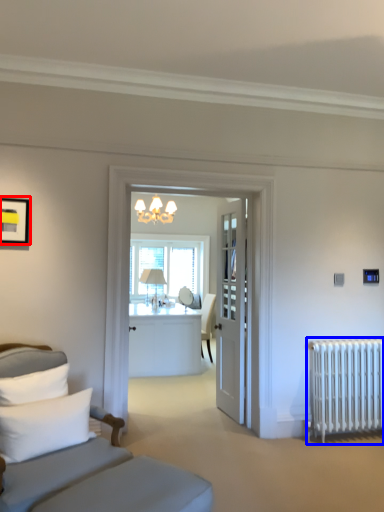
Question: Among these objects, which one is nearest to the camera, picture frame (highlighted by a red box) or radiator (highlighted by a blue box)?

Choices:
 (A) picture frame
 (B) radiator

Answer: (A)